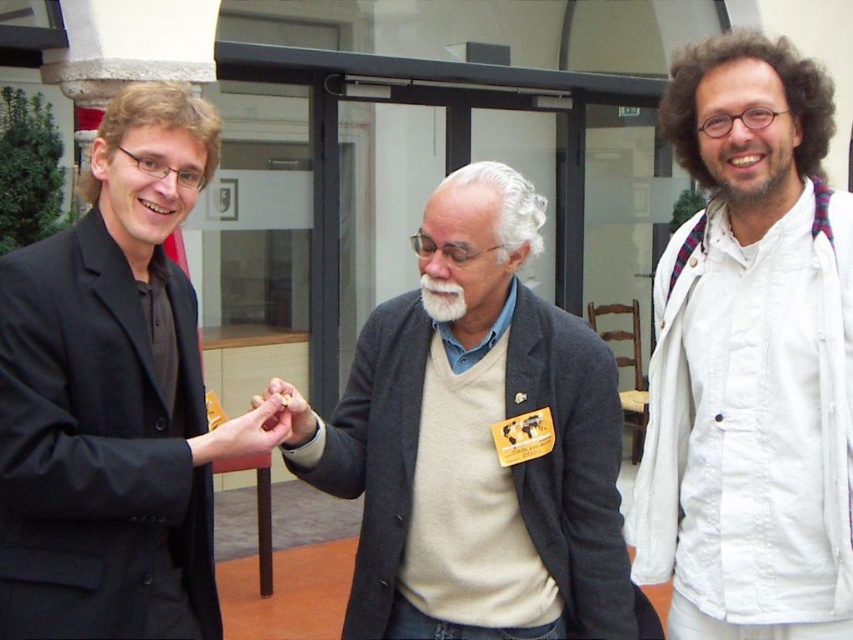
Question: Does white cotton shirt at right appear over beardsoft hair at right?

Choices:
 (A) no
 (B) yes

Answer: (A)

Question: Estimate the real-world distances between objects in this image. Which object is closer to the matte gold ring at center?

Choices:
 (A) matte brown paper at center
 (B) black matte suit at left
 (C) white cotton shirt at right
 (D) white soft beard at center

Answer: (A)

Question: Considering the real-world distances, which object is farthest from the white cotton shirt at right?

Choices:
 (A) beige sweater at center
 (B) white soft beard at center
 (C) black matte suit at left

Answer: (C)

Question: Does beige sweater at center appear on the left side of beardsoft hair at right?

Choices:
 (A) yes
 (B) no

Answer: (A)

Question: Is beardsoft hair at right above white soft beard at center?

Choices:
 (A) no
 (B) yes

Answer: (B)

Question: Based on their relative distances, which object is farther from the beardsoft hair at right?

Choices:
 (A) matte brown paper at center
 (B) black matte suit at left

Answer: (B)